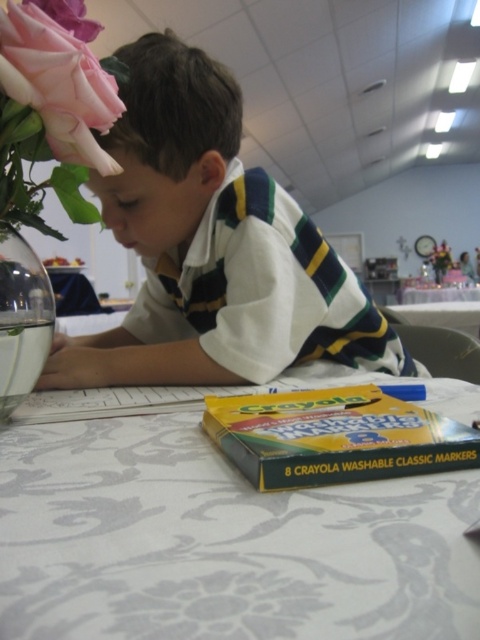
Which of these two, white damask tablecloth at lower center or pink silk flower at upper left, stands shorter?

white damask tablecloth at lower center

Is point (477, 598) closer to camera compared to point (440, 252)?

That is True.

This screenshot has height=640, width=480. I want to click on white damask tablecloth at lower center, so click(x=219, y=541).

Looking at this image, between clear glass vase at left and pink silk flower at upper left, which one has more height?

With more height is pink silk flower at upper left.

The image size is (480, 640). Identify the location of clear glass vase at left. (22, 320).

Is yellow cardboard box of markers at lower center shorter than pink silk flower at upper left?

Correct, yellow cardboard box of markers at lower center is not as tall as pink silk flower at upper left.

Could you measure the distance between yellow cardboard box of markers at lower center and pink silk flower at upper left?

yellow cardboard box of markers at lower center is 4.95 meters from pink silk flower at upper left.

Describe the element at coordinates (335, 436) in the screenshot. I see `yellow cardboard box of markers at lower center` at that location.

What are the coordinates of `yellow cardboard box of markers at lower center` in the screenshot? It's located at (335, 436).